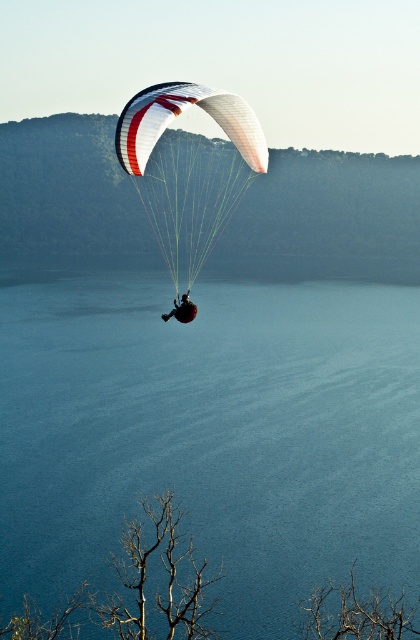
You are a photographer trying to capture the green leafy tree at center and the matte black parachute at center in a single shot. Based on their sizes in the image, which object would appear bigger in your photo?

The green leafy tree at center appears larger than the matte black parachute at center in the image.

You are a photographer trying to capture the matte black parachute at center and the green leafy tree at center in a single shot. Which object will appear closer to the camera in the photo?

The green leafy tree at center will appear closer to the camera because it is positioned further to the viewer compared to the matte black parachute at center.

You are a photographer trying to capture the paraglider in the image. The paraglider is at point (189, 168). You need to position your camera so that the white matte parachute at center is centered in your shot. Where should you aim your camera?

You should aim your camera at point (189, 168), where the white matte parachute at center is located.